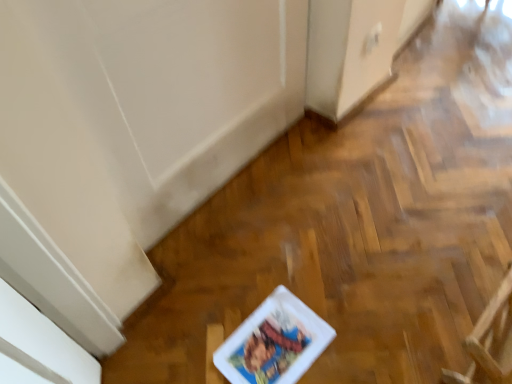
Image resolution: width=512 pixels, height=384 pixels. I want to click on free spot below white glossy comic book at center (from a real-world perspective), so click(268, 342).